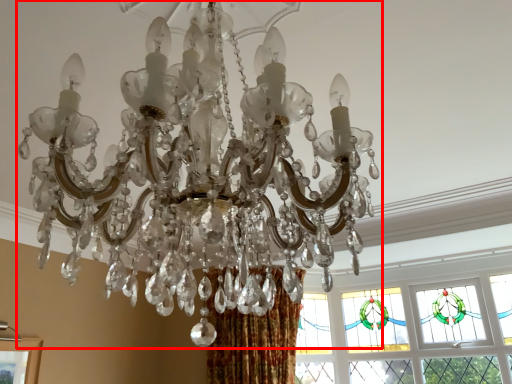
Question: Observing the image, what is the correct spatial positioning of lamp (annotated by the red box) in reference to window?

Choices:
 (A) left
 (B) right

Answer: (A)